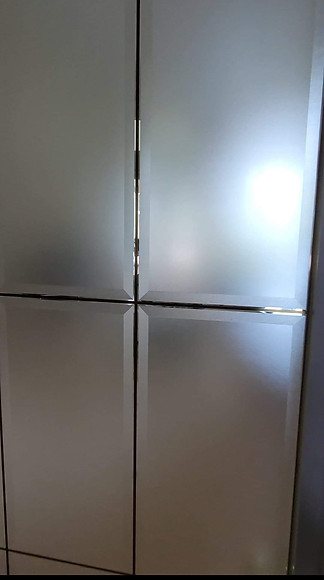
This screenshot has width=324, height=580. In order to click on tiles in this screenshot , I will do [x=66, y=205], [x=211, y=282], [x=199, y=382], [x=112, y=372], [x=43, y=563], [x=3, y=558], [x=2, y=532].